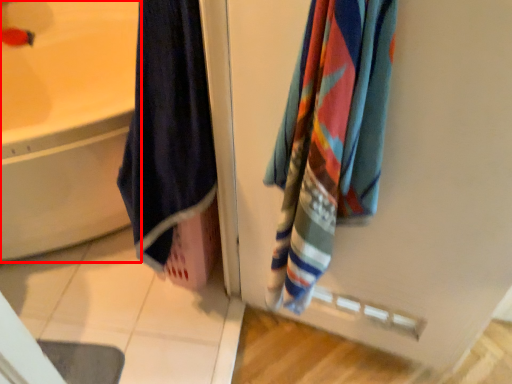
Question: From the image's perspective, where is bathtub (annotated by the red box) located relative to towel?

Choices:
 (A) above
 (B) below

Answer: (A)